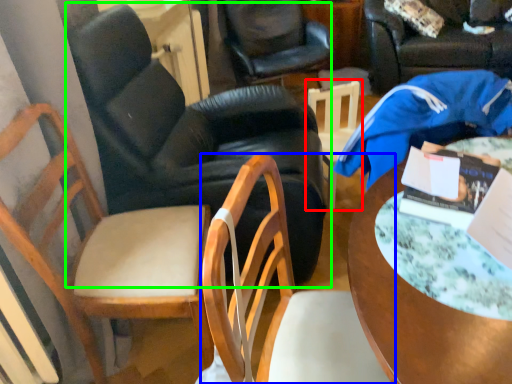
Question: Estimate the real-world distances between objects in this image. Which object is closer to chair (highlighted by a red box), chair (highlighted by a blue box) or chair (highlighted by a green box)?

Choices:
 (A) chair
 (B) chair

Answer: (B)